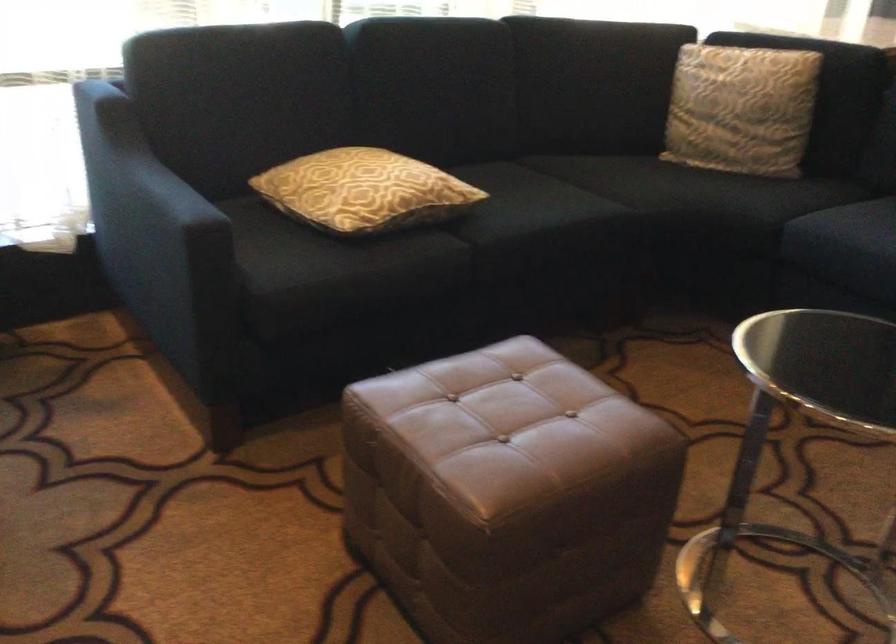
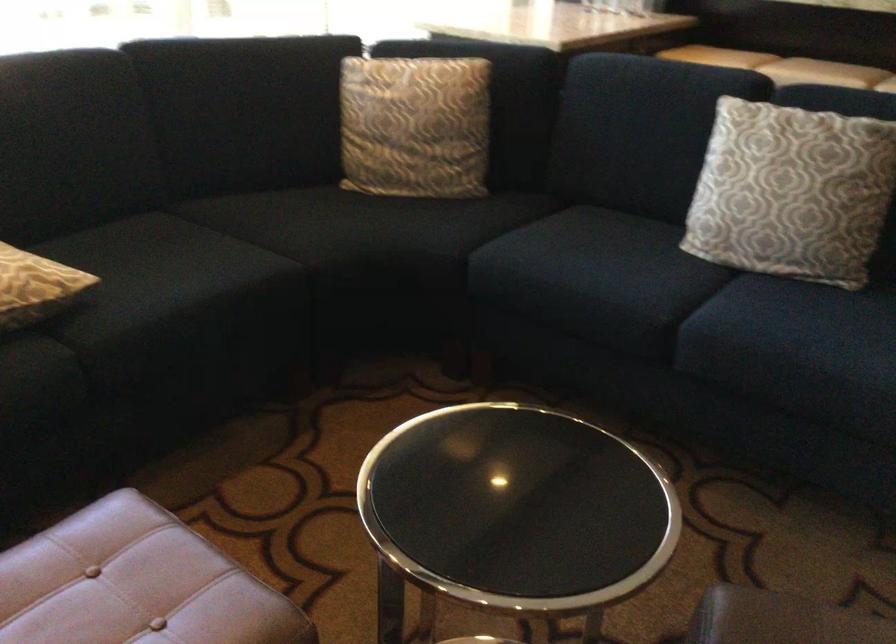
Find the pixel in the second image that matches point (437, 196) in the first image.

(35, 287)